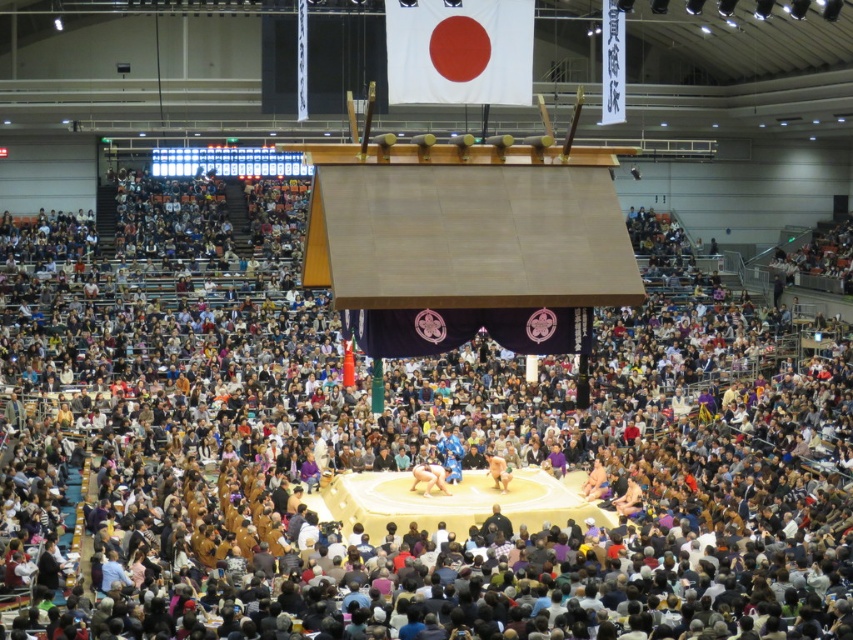
Question: Does white fabric flag at upper center have a lesser width compared to smooth beige sumo wrestler at center?

Choices:
 (A) yes
 (B) no

Answer: (B)

Question: Among these points, which one is farthest from the camera?

Choices:
 (A) (428, 13)
 (B) (495, 484)

Answer: (A)

Question: Can you confirm if white fabric flag at upper center is smaller than smooth beige sumo wrestler at center?

Choices:
 (A) yes
 (B) no

Answer: (B)

Question: Which point is closer to the camera taking this photo?

Choices:
 (A) (529, 104)
 (B) (508, 468)

Answer: (B)

Question: Is white fabric flag at upper center positioned before smooth beige sumo wrestler at center?

Choices:
 (A) yes
 (B) no

Answer: (B)